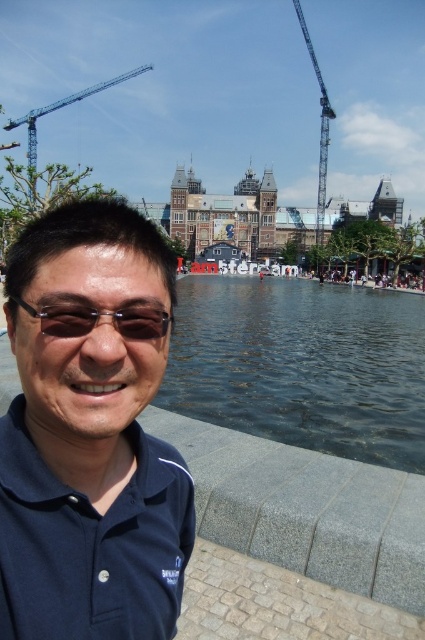
Is point (146, 323) more distant than point (297, 16)?

That is False.

Measure the distance between dark blue shirt at center and metallic blue crane at upper right.

A distance of 97.32 meters exists between dark blue shirt at center and metallic blue crane at upper right.

Is point (13, 324) positioned before point (317, 220)?

Yes, point (13, 324) is in front of point (317, 220).

Where is `dark blue shirt at center`? dark blue shirt at center is located at coordinates (90, 433).

This screenshot has height=640, width=425. Describe the element at coordinates (98, 320) in the screenshot. I see `sunglasses at center` at that location.

I want to click on sunglasses at center, so click(x=98, y=320).

You are a GUI agent. You are given a task and a screenshot of the screen. Output one action in this format:
    pyautogui.click(x=<x>, y=<y>)
    Task: Click on the sunglasses at center
    Image resolution: width=425 pixels, height=640 pixels.
    Given the screenshot: What is the action you would take?
    pyautogui.click(x=98, y=320)

Who is positioned more to the right, dark blue shirt at center or blue metallic crane at upper left?

Positioned to the right is dark blue shirt at center.

Which is below, dark blue shirt at center or blue metallic crane at upper left?

dark blue shirt at center

Is point (76, 216) closer to viewer compared to point (33, 112)?

That is True.

This screenshot has height=640, width=425. Find the location of `dark blue shirt at center`. dark blue shirt at center is located at coordinates (90, 433).